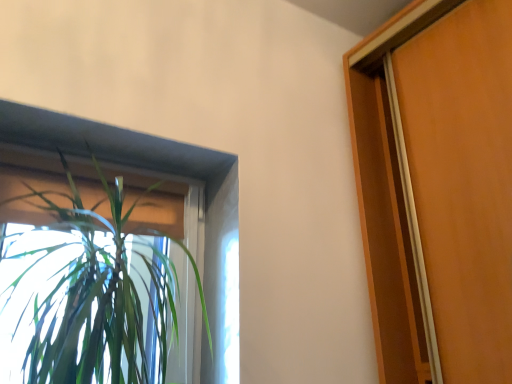
What do you see at coordinates (106, 271) in the screenshot? This screenshot has height=384, width=512. I see `green leafy plant at left` at bounding box center [106, 271].

This screenshot has height=384, width=512. What are the coordinates of `green leafy plant at left` in the screenshot? It's located at (106, 271).

Locate an element on the screen. The width and height of the screenshot is (512, 384). green leafy plant at left is located at coordinates (106, 271).